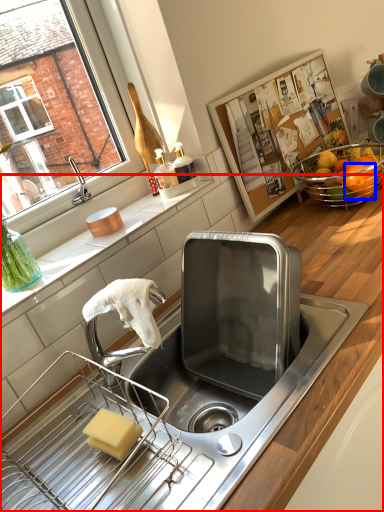
Question: Which point is further to the camera, countertop (highlighted by a red box) or orange (highlighted by a blue box)?

Choices:
 (A) countertop
 (B) orange

Answer: (B)